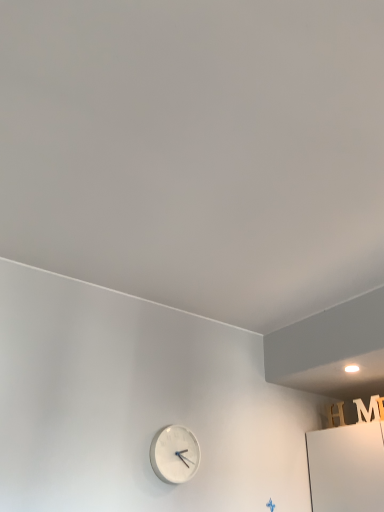
Question: Can you confirm if white matte clock at lower center is positioned to the right of white matte letter m at upper right?

Choices:
 (A) no
 (B) yes

Answer: (A)

Question: From a real-world perspective, is white matte clock at lower center below white matte letter m at upper right?

Choices:
 (A) no
 (B) yes

Answer: (B)

Question: Considering the relative sizes of white matte clock at lower center and white matte letter m at upper right in the image provided, is white matte clock at lower center wider than white matte letter m at upper right?

Choices:
 (A) no
 (B) yes

Answer: (B)

Question: Is white matte clock at lower center bigger than white matte letter m at upper right?

Choices:
 (A) no
 (B) yes

Answer: (B)

Question: Considering the relative sizes of white matte clock at lower center and white matte letter m at upper right in the image provided, is white matte clock at lower center shorter than white matte letter m at upper right?

Choices:
 (A) no
 (B) yes

Answer: (A)

Question: Does white matte clock at lower center have a greater height compared to white matte letter m at upper right?

Choices:
 (A) yes
 (B) no

Answer: (A)

Question: Considering the relative sizes of white matte letter m at upper right and white matte clock at lower center in the image provided, is white matte letter m at upper right shorter than white matte clock at lower center?

Choices:
 (A) yes
 (B) no

Answer: (A)

Question: Does white matte letter m at upper right have a greater width compared to white matte clock at lower center?

Choices:
 (A) yes
 (B) no

Answer: (B)

Question: From the image's perspective, is white matte letter m at upper right below white matte clock at lower center?

Choices:
 (A) yes
 (B) no

Answer: (B)

Question: Is white matte letter m at upper right facing towards white matte clock at lower center?

Choices:
 (A) yes
 (B) no

Answer: (A)

Question: Does white matte letter m at upper right have a lesser width compared to white matte clock at lower center?

Choices:
 (A) yes
 (B) no

Answer: (A)

Question: Is white matte letter m at upper right not within white matte clock at lower center?

Choices:
 (A) no
 (B) yes

Answer: (B)

Question: Looking at their shapes, would you say white matte clock at lower center is wider or thinner than white matte letter m at upper right?

Choices:
 (A) thin
 (B) wide

Answer: (B)